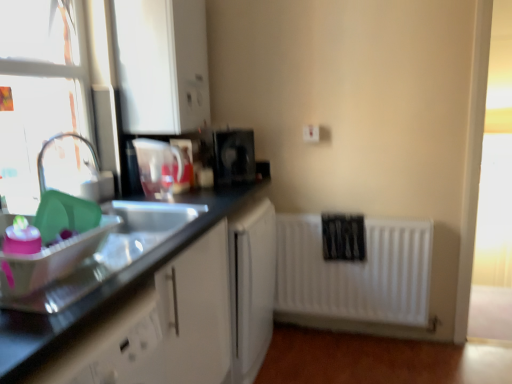
Question: In which direction should I rotate to look at translucent plastic pitcher at upper center, the 1th appliance viewed from the left?

Choices:
 (A) right
 (B) left

Answer: (B)

Question: Is clear glass window at left bigger than black plastic coffee maker at center, which appears as the 1th appliance when viewed from the back?

Choices:
 (A) no
 (B) yes

Answer: (B)

Question: Is the position of clear glass window at left less distant than that of black plastic coffee maker at center, the second appliance positioned from the left?

Choices:
 (A) no
 (B) yes

Answer: (B)

Question: Does clear glass window at left contain black plastic coffee maker at center, which is the 1th appliance from right to left?

Choices:
 (A) yes
 (B) no

Answer: (B)

Question: Can you confirm if clear glass window at left is smaller than black plastic coffee maker at center, which appears as the 1th appliance when viewed from the back?

Choices:
 (A) no
 (B) yes

Answer: (A)

Question: Does clear glass window at left have a greater height compared to black plastic coffee maker at center, which is counted as the second appliance, starting from the front?

Choices:
 (A) no
 (B) yes

Answer: (B)

Question: Is clear glass window at left not near black plastic coffee maker at center, the second appliance positioned from the left?

Choices:
 (A) yes
 (B) no

Answer: (B)

Question: Does white plastic electric outlet at upper center appear on the left side of white matte radiator at lower right?

Choices:
 (A) yes
 (B) no

Answer: (A)

Question: From the image's perspective, is white plastic electric outlet at upper center beneath white matte radiator at lower right?

Choices:
 (A) no
 (B) yes

Answer: (A)

Question: Is white plastic electric outlet at upper center positioned before white matte radiator at lower right?

Choices:
 (A) no
 (B) yes

Answer: (A)

Question: Is white plastic electric outlet at upper center bigger than white matte radiator at lower right?

Choices:
 (A) yes
 (B) no

Answer: (B)

Question: Can you confirm if white plastic electric outlet at upper center is thinner than white matte radiator at lower right?

Choices:
 (A) yes
 (B) no

Answer: (A)

Question: Can you confirm if white plastic electric outlet at upper center is smaller than white matte radiator at lower right?

Choices:
 (A) no
 (B) yes

Answer: (B)

Question: Is translucent plastic pitcher at upper center, the 1th appliance viewed from the left, surrounding black plastic coffee maker at center, which appears as the 1th appliance when viewed from the back?

Choices:
 (A) yes
 (B) no

Answer: (B)